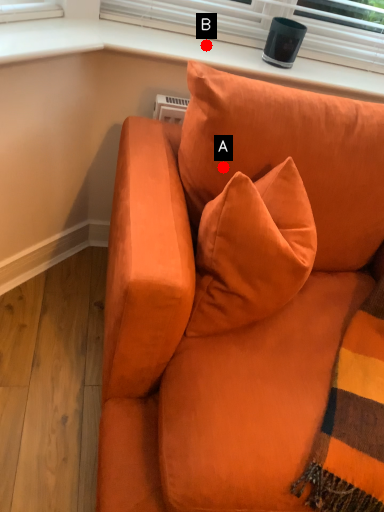
Question: Two points are circled on the image, labeled by A and B beside each circle. Which point is further to the camera?

Choices:
 (A) A is further
 (B) B is further

Answer: (B)